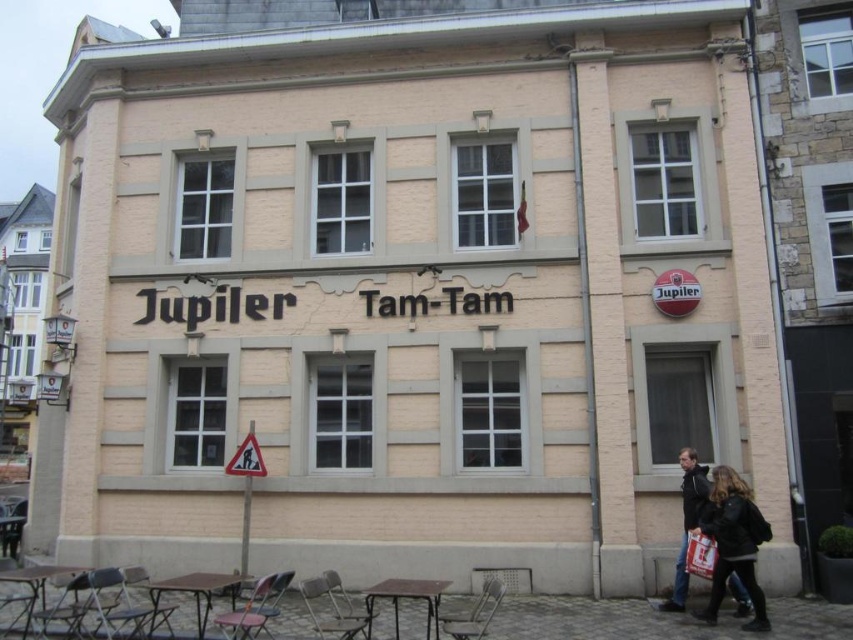
You are standing in front of the Jupiler Tam Tam building and want to hang a new sign. You have two points marked on the facade at point coordinates point (735,596) and point (699,557). Which point is closer to you so you can hang the sign easily?

Point (735,596) is further to the viewer than point (699,557), so the point (699,557) is closer to you and easier to reach for hanging the sign.